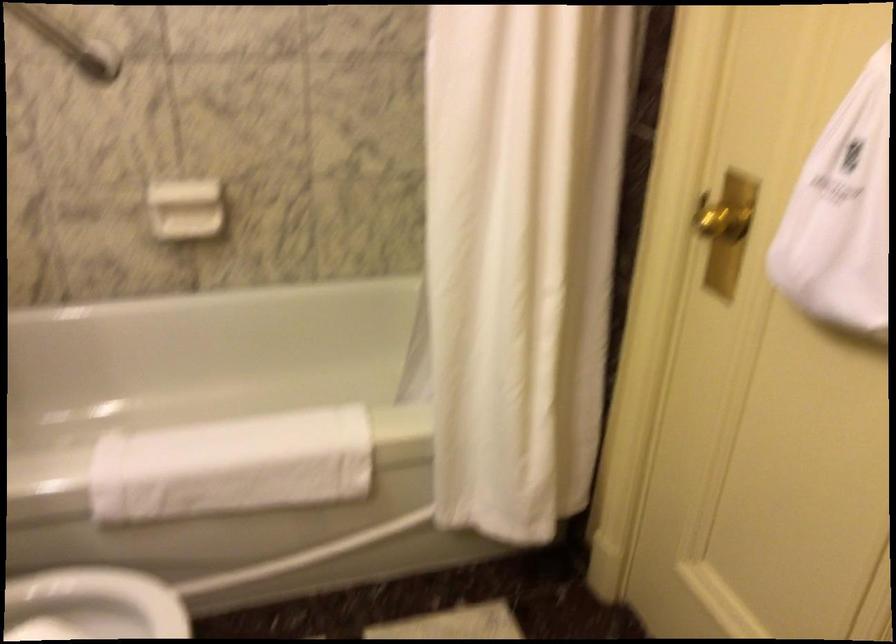
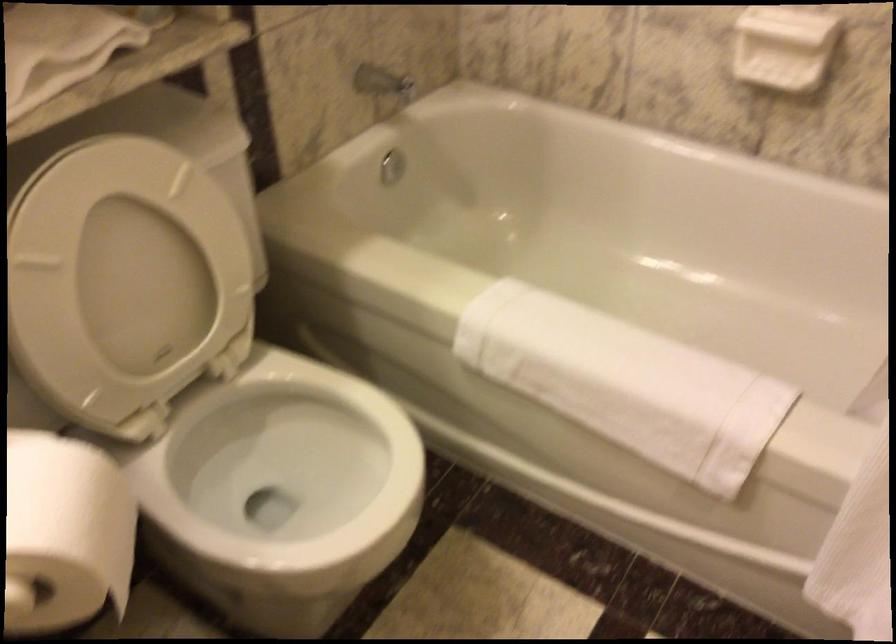
Find the pixel in the second image that matches point (183, 199) in the first image.

(782, 46)